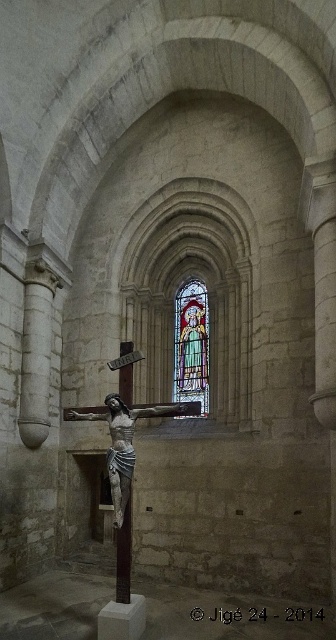
Is stained glass window at center taller than polished silver crucifix at center?

In fact, stained glass window at center may be shorter than polished silver crucifix at center.

Which of these two, stained glass window at center or polished silver crucifix at center, stands shorter?

With less height is stained glass window at center.

Does point (189, 292) come farther from viewer compared to point (113, 468)?

Yes.

Where is `stained glass window at center`? Image resolution: width=336 pixels, height=640 pixels. stained glass window at center is located at coordinates (191, 344).